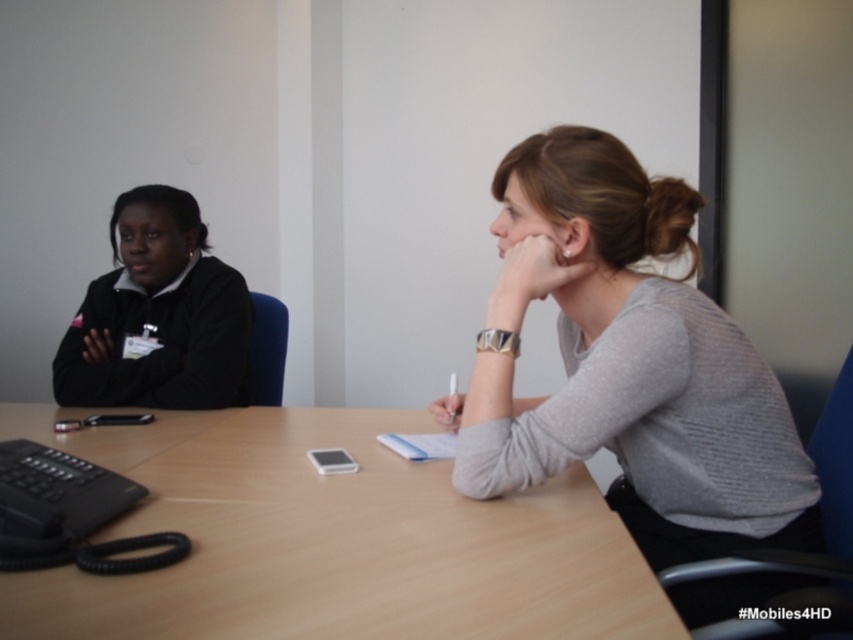
You are organizing a small gathering and need to place a gray sweater at center on a light brown wood table at center. Based on the description, will the sweater fit on the table?

The light brown wood table at center has a smaller size compared to gray sweater at center, so the sweater will not fit on the table.

You are standing at the center of the table in the conference room. There are two points marked on the table surface. The first point is labeled as point (4, 435) and the second point is labeled as point (202, 404). If you want to move from the first point to the second point, which direction should you move relative to your current position?

To move from point (4, 435) to point (202, 404), you should move backward since point (4, 435) is in front of point (202, 404).